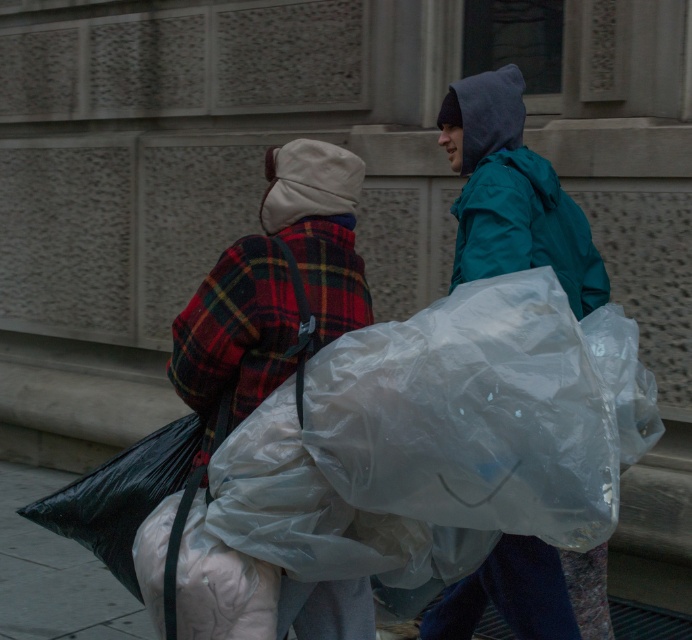
You are standing at the origin point of the image. Which object is located at the coordinates point [275,285]?

The flannel plaid jacket at center is located at point [275,285].

Looking at this image, you are a pedestrian standing on the sidewalk in front of the building. You notice the flannel plaid jacket at center and the transparent plastic bag at right. Which object is closer to the ground?

The flannel plaid jacket at center is closer to the ground because it is positioned below the transparent plastic bag at right.

You are a photographer standing in front of the building with the textured facade. You want to take a photo of both the flannel plaid jacket at center and the transparent plastic bag at right. Which object should you focus on first if you want to ensure both are in sharp focus?

The flannel plaid jacket at center is taller than the transparent plastic bag at right, so focusing on the flannel plaid jacket at center first will help ensure both are in sharp focus since it is the larger object.